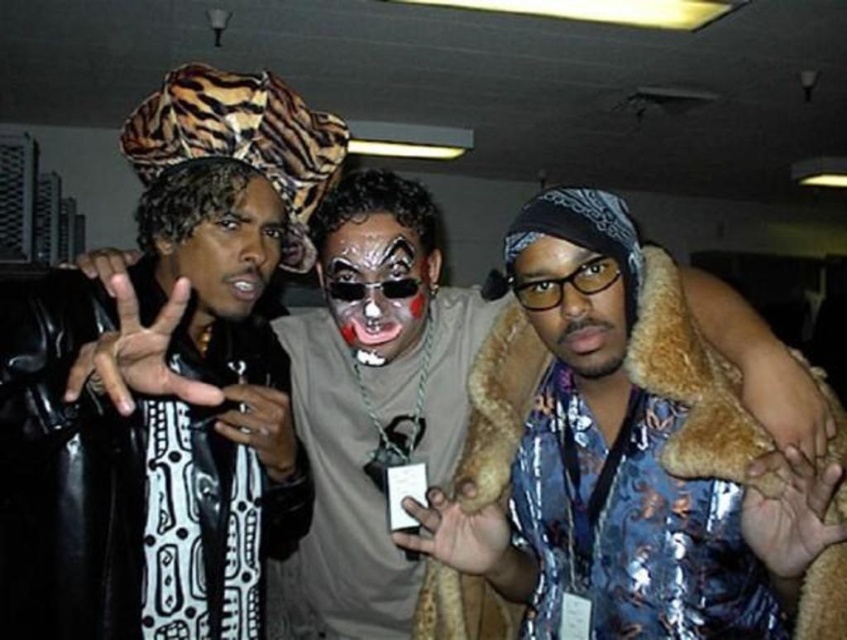
Question: Can you confirm if leather jacket at center is positioned below matte black face at center?

Choices:
 (A) no
 (B) yes

Answer: (B)

Question: Does leather jacket at center have a greater width compared to shiny metallic face at center?

Choices:
 (A) yes
 (B) no

Answer: (A)

Question: Which object is farther from the camera taking this photo?

Choices:
 (A) matte black face paint at center
 (B) matte black face at center

Answer: (A)

Question: Which of the following is the farthest from the observer?

Choices:
 (A) (613, 362)
 (B) (161, 436)

Answer: (B)

Question: Can you confirm if matte black face paint at center is wider than matte black face at center?

Choices:
 (A) no
 (B) yes

Answer: (B)

Question: Which of the following is the closest to the observer?

Choices:
 (A) (403, 324)
 (B) (130, 420)

Answer: (B)